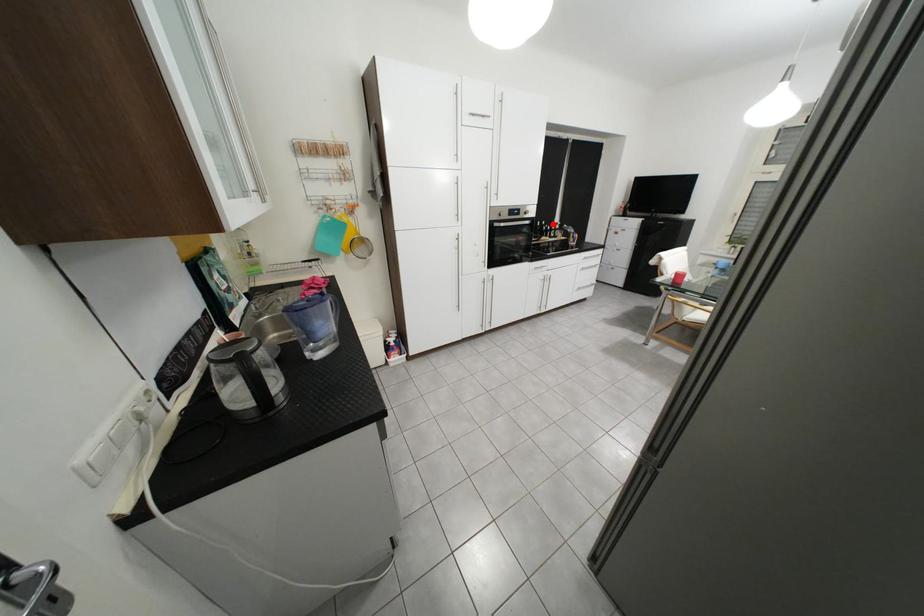
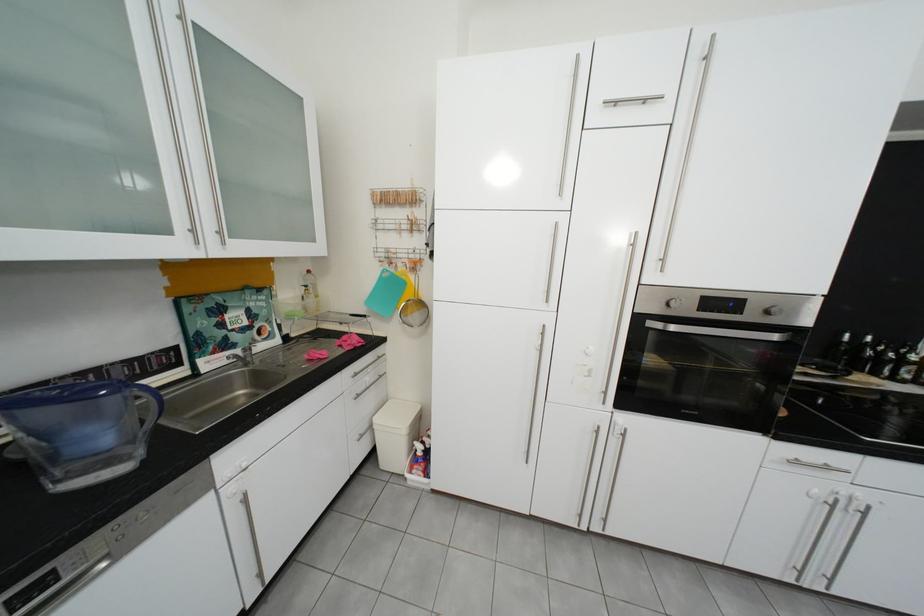
Where in the second image is the point corresponding to the highlighted location from the first image?

(869, 339)